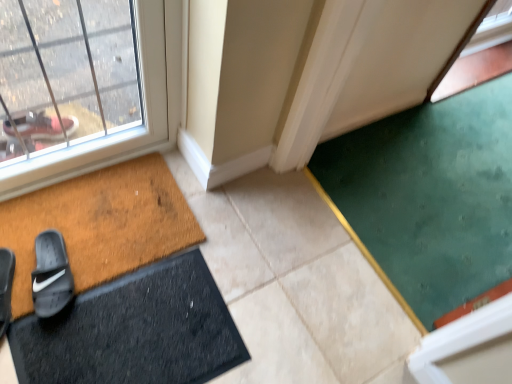
You are a GUI agent. You are given a task and a screenshot of the screen. Output one action in this format:
    pyautogui.click(x=<x>, y=<y>)
    Task: Click on the vacant space underneath black rubber bath mat at lower left, which is the second bath mat in top-to-bottom order (from a real-world perspective)
    This screenshot has width=512, height=384.
    Given the screenshot: What is the action you would take?
    pyautogui.click(x=167, y=338)